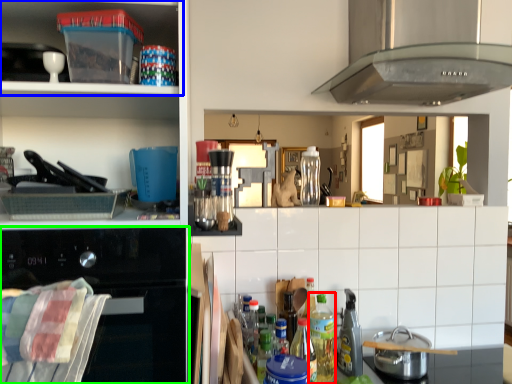
Question: Based on their relative distances, which object is farther from bottle (highlighted by a red box)? Choose from shelf (highlighted by a blue box) and home appliance (highlighted by a green box).

Choices:
 (A) shelf
 (B) home appliance

Answer: (A)